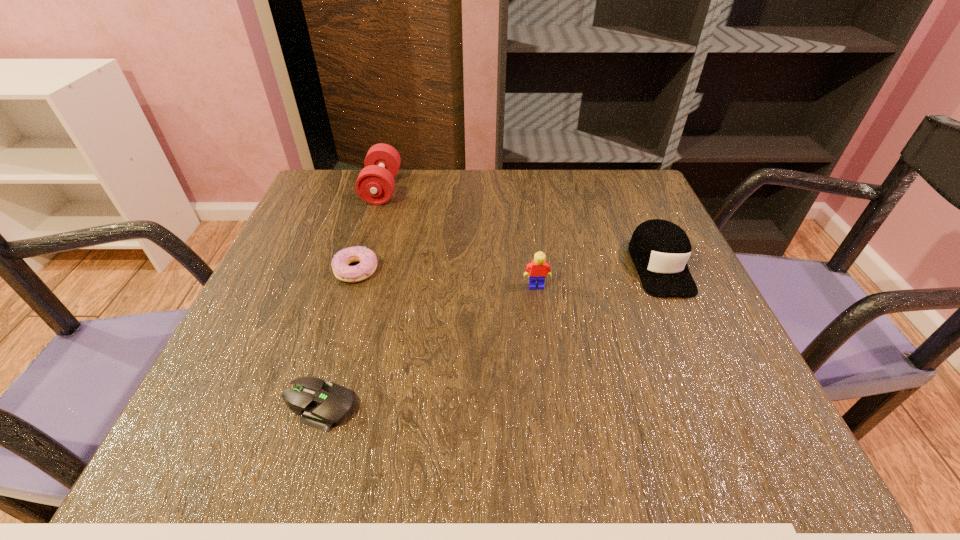
Where is `free space between the farthest object and the cap`? The image size is (960, 540). free space between the farthest object and the cap is located at coordinates (520, 227).

Identify the location of vacant space that is in between the dumbbell and the rightmost object. The width and height of the screenshot is (960, 540). (520, 227).

Where is `free point between the farthest object and the cap`? free point between the farthest object and the cap is located at coordinates (520, 227).

The image size is (960, 540). I want to click on vacant area that lies between the fourth tallest object and the rightmost object, so click(508, 268).

Select which object is the second closest to the computer mouse. Please provide its 2D coordinates. Your answer should be formatted as a tuple, i.e. [(x, y)], where the tuple contains the x and y coordinates of a point satisfying the conditions above.

[(538, 268)]

Choose which object is the second nearest neighbor to the fourth tallest object. Please provide its 2D coordinates. Your answer should be formatted as a tuple, i.e. [(x, y)], where the tuple contains the x and y coordinates of a point satisfying the conditions above.

[(322, 404)]